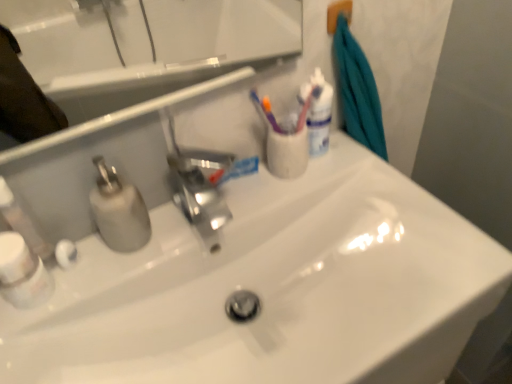
The image size is (512, 384). What are the coordinates of `free spot to the right of white plastic soap dispenser at left` in the screenshot? It's located at (134, 251).